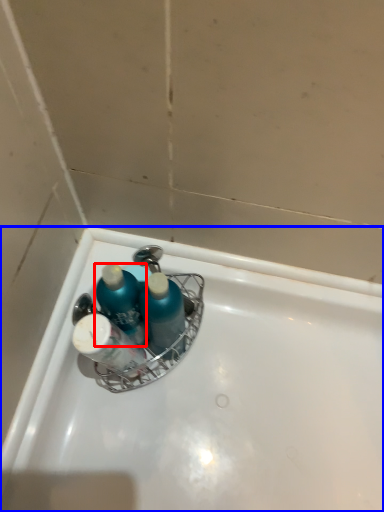
Question: Which point is further to the camera, mouthwash (highlighted by a red box) or bathtub (highlighted by a blue box)?

Choices:
 (A) mouthwash
 (B) bathtub

Answer: (B)